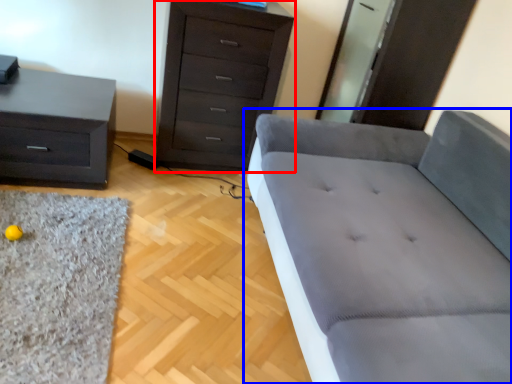
Question: Which object appears closest to the camera in this image, chest of drawers (highlighted by a red box) or studio couch (highlighted by a blue box)?

Choices:
 (A) chest of drawers
 (B) studio couch

Answer: (B)